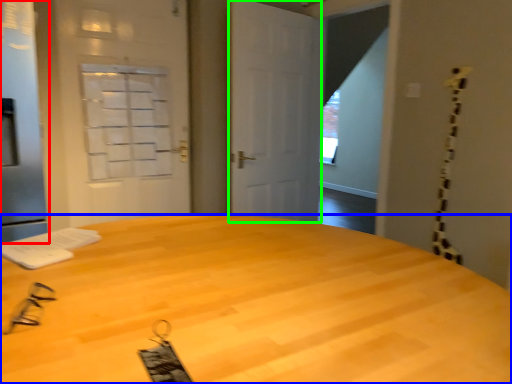
Question: Estimate the real-world distances between objects in this image. Which object is closer to screen door (highlighted by a red box), desk (highlighted by a blue box) or door (highlighted by a green box)?

Choices:
 (A) desk
 (B) door

Answer: (A)